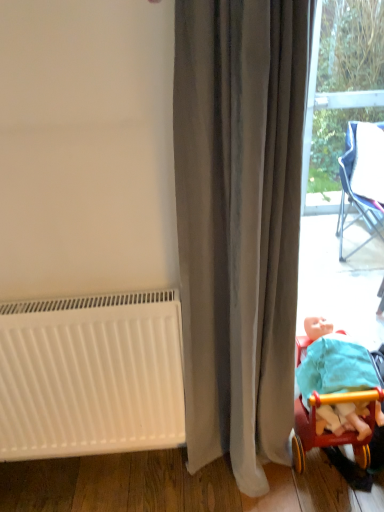
Question: From the image's perspective, does gray velvet curtain at center appear higher than white matte radiator at lower left?

Choices:
 (A) yes
 (B) no

Answer: (A)

Question: Is gray velvet curtain at center next to white matte radiator at lower left?

Choices:
 (A) no
 (B) yes

Answer: (A)

Question: Does gray velvet curtain at center have a greater width compared to white matte radiator at lower left?

Choices:
 (A) yes
 (B) no

Answer: (A)

Question: Does gray velvet curtain at center appear on the right side of white matte radiator at lower left?

Choices:
 (A) no
 (B) yes

Answer: (B)

Question: Is gray velvet curtain at center not inside white matte radiator at lower left?

Choices:
 (A) no
 (B) yes

Answer: (B)

Question: Does point (97, 340) appear closer or farther from the camera than point (296, 429)?

Choices:
 (A) closer
 (B) farther

Answer: (A)

Question: Is white matte radiator at lower left taller or shorter than wooden toy carriage at lower right?

Choices:
 (A) short
 (B) tall

Answer: (B)

Question: From the image's perspective, is white matte radiator at lower left located above or below wooden toy carriage at lower right?

Choices:
 (A) below
 (B) above

Answer: (B)

Question: Is white matte radiator at lower left in front of or behind wooden toy carriage at lower right in the image?

Choices:
 (A) behind
 (B) front

Answer: (B)

Question: In the image, is wooden toy carriage at lower right positioned in front of or behind gray velvet curtain at center?

Choices:
 (A) front
 (B) behind

Answer: (B)

Question: Would you say wooden toy carriage at lower right is inside or outside gray velvet curtain at center?

Choices:
 (A) outside
 (B) inside

Answer: (A)

Question: Is point (299, 430) positioned closer to the camera than point (198, 258)?

Choices:
 (A) farther
 (B) closer

Answer: (A)

Question: From the image's perspective, is wooden toy carriage at lower right located above or below gray velvet curtain at center?

Choices:
 (A) above
 (B) below

Answer: (B)

Question: Is point (226, 359) positioned closer to the camera than point (23, 406)?

Choices:
 (A) farther
 (B) closer

Answer: (A)

Question: From a real-world perspective, relative to white matte radiator at lower left, is gray velvet curtain at center vertically above or below?

Choices:
 (A) above
 (B) below

Answer: (A)